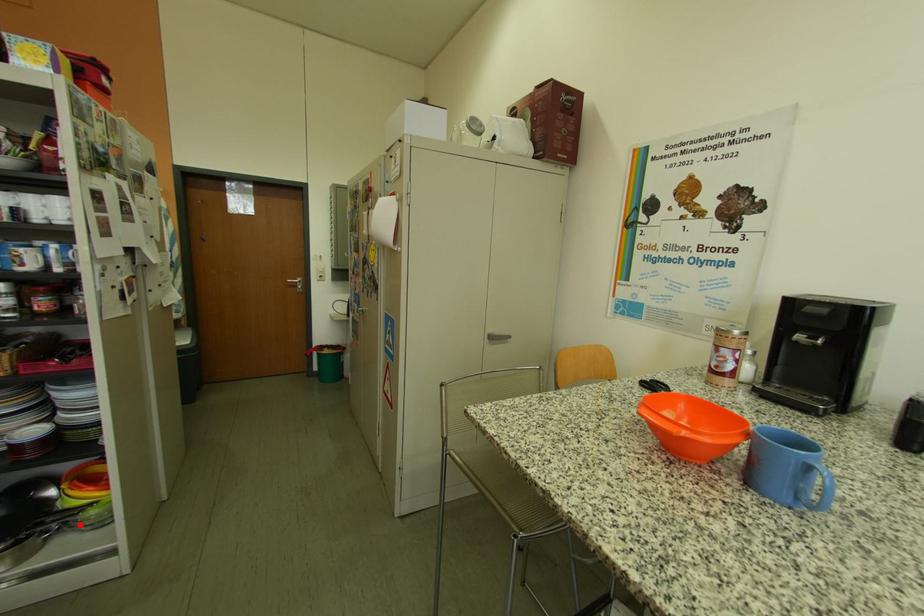
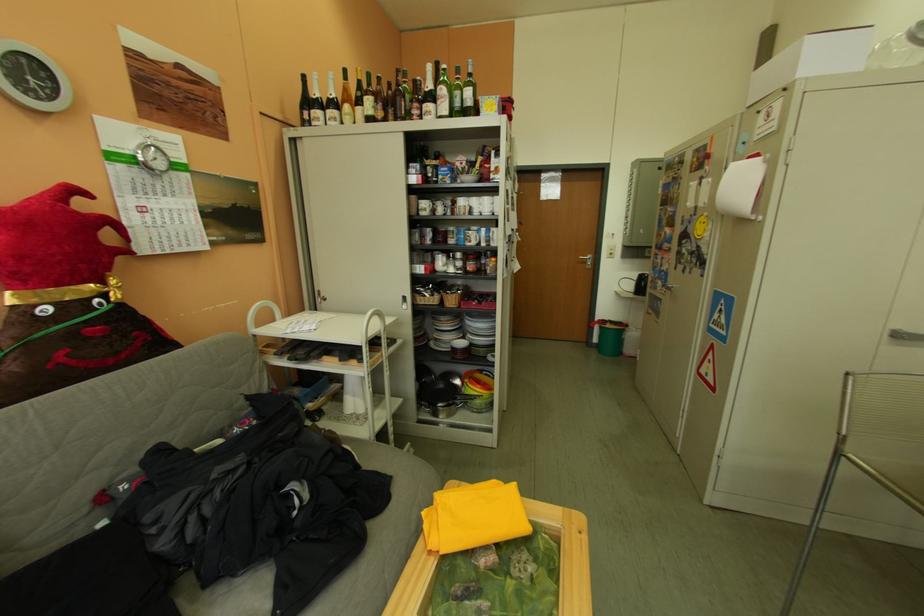
Where in the second image is the point corresponding to the highlighted location from the first image?

(478, 405)